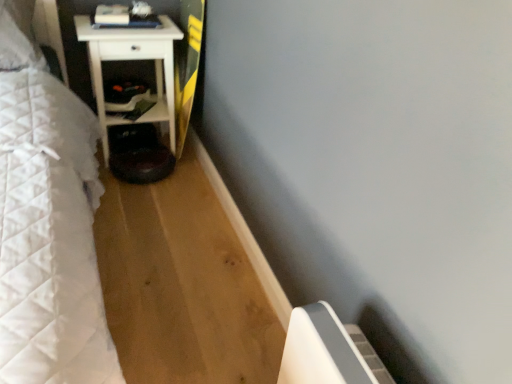
Question: Can you confirm if matte black shelf at lower left is thinner than shiny black step stool at lower center?

Choices:
 (A) no
 (B) yes

Answer: (B)

Question: Does matte black shelf at lower left have a greater height compared to shiny black step stool at lower center?

Choices:
 (A) no
 (B) yes

Answer: (B)

Question: Is the position of matte black shelf at lower left less distant than that of shiny black step stool at lower center?

Choices:
 (A) no
 (B) yes

Answer: (A)

Question: From a real-world perspective, does matte black shelf at lower left sit lower than shiny black step stool at lower center?

Choices:
 (A) yes
 (B) no

Answer: (B)

Question: Can you confirm if matte black shelf at lower left is positioned to the right of shiny black step stool at lower center?

Choices:
 (A) no
 (B) yes

Answer: (A)

Question: From a real-world perspective, is matte black shelf at lower left positioned over shiny black step stool at lower center based on gravity?

Choices:
 (A) no
 (B) yes

Answer: (B)

Question: Is yellow-green wood longboard at center positioned far away from shiny black step stool at lower center?

Choices:
 (A) no
 (B) yes

Answer: (A)

Question: From a real-world perspective, does yellow-green wood longboard at center stand above shiny black step stool at lower center?

Choices:
 (A) yes
 (B) no

Answer: (A)

Question: Is the surface of yellow-green wood longboard at center in direct contact with shiny black step stool at lower center?

Choices:
 (A) no
 (B) yes

Answer: (A)

Question: From the image's perspective, is yellow-green wood longboard at center located beneath shiny black step stool at lower center?

Choices:
 (A) no
 (B) yes

Answer: (A)

Question: Considering the relative positions of yellow-green wood longboard at center and shiny black step stool at lower center in the image provided, is yellow-green wood longboard at center behind shiny black step stool at lower center?

Choices:
 (A) yes
 (B) no

Answer: (B)

Question: Does yellow-green wood longboard at center contain shiny black step stool at lower center?

Choices:
 (A) no
 (B) yes

Answer: (A)

Question: Is shiny black step stool at lower center at the left side of white matte nightstand at left?

Choices:
 (A) yes
 (B) no

Answer: (B)